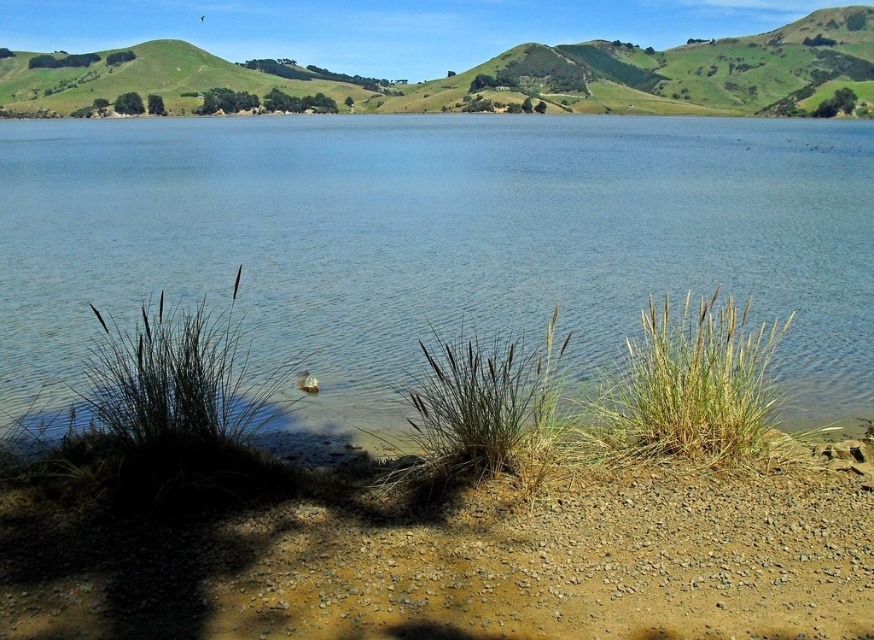
From the picture: You are a photographer trying to capture the white fluffy duck at lower center in the foreground of your shot. The brown gravelly sand at lower center is in the background. Since you want the duck to stand out, would the sand behind it appear taller or shorter than the duck in the photo?

The brown gravelly sand at lower center is taller than the white fluffy duck at lower center, so in the photo, the sand behind the duck would appear taller than the duck, which might make the duck less prominent against the sand.

You are standing at the edge of the lakeside and notice the brown gravelly sand at lower center and the brown grass at lower center. Which object is located to the right of the other?

The brown gravelly sand at lower center is positioned on the right side of brown grass at lower center.

You are a small robot with a 1.5 meter reach. You are standing on the brown gravelly sand at lower center and want to pick up the white fluffy duck at lower center. Can you reach it with your current arm extension?

The distance between the brown gravelly sand at lower center and the white fluffy duck at lower center is 5.52 meters. Since your reach is only 1.5 meters, you cannot reach the duck.